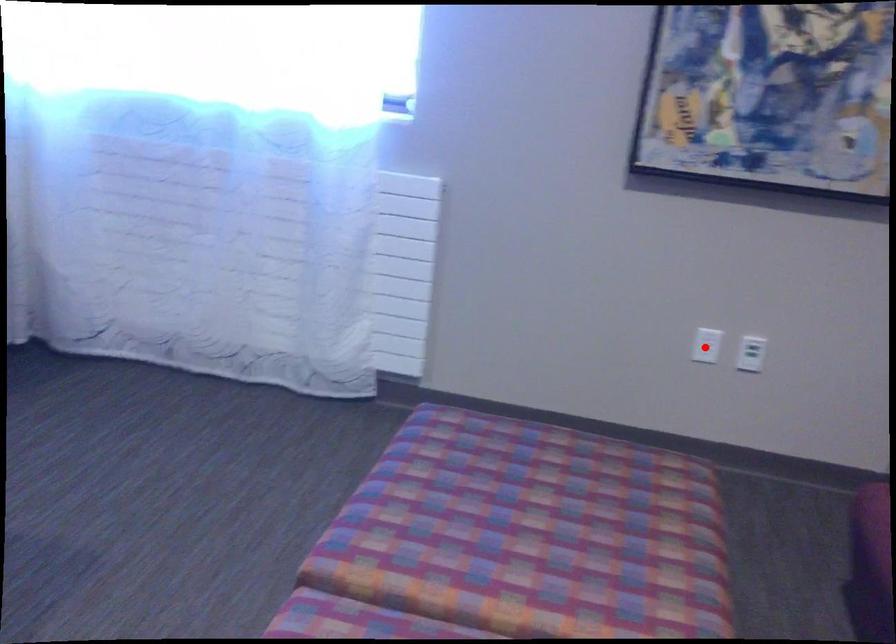
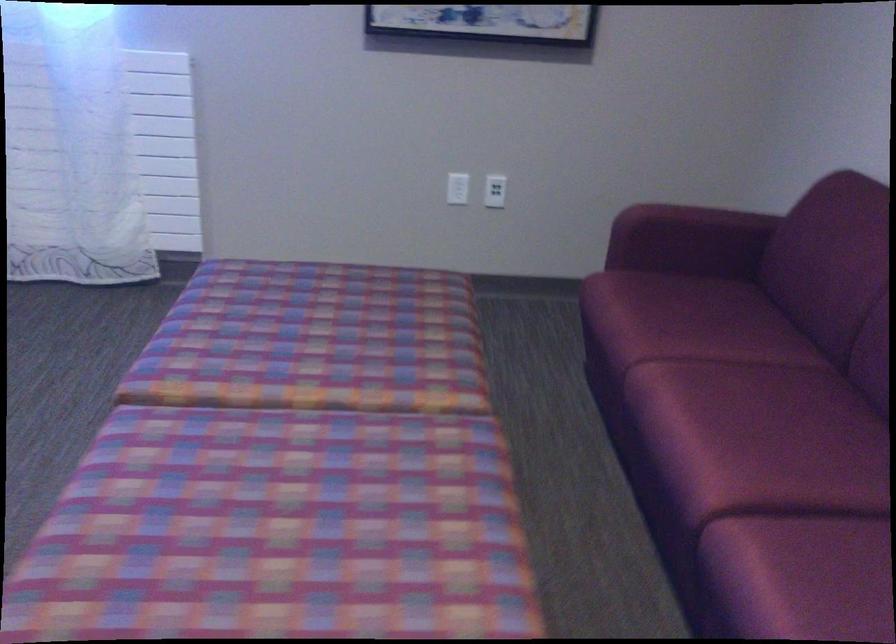
Locate, in the second image, the point that corresponds to the highlighted location in the first image.

(458, 187)